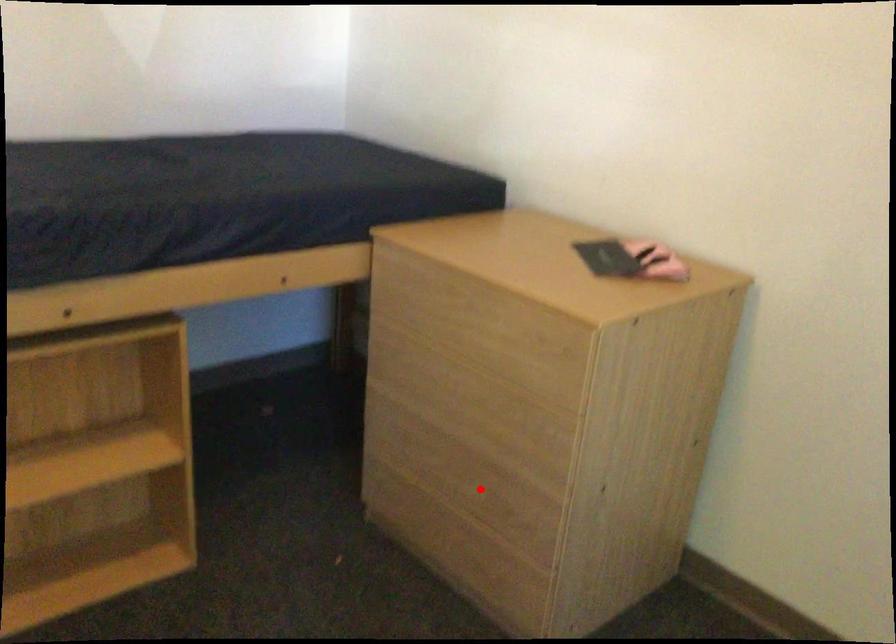
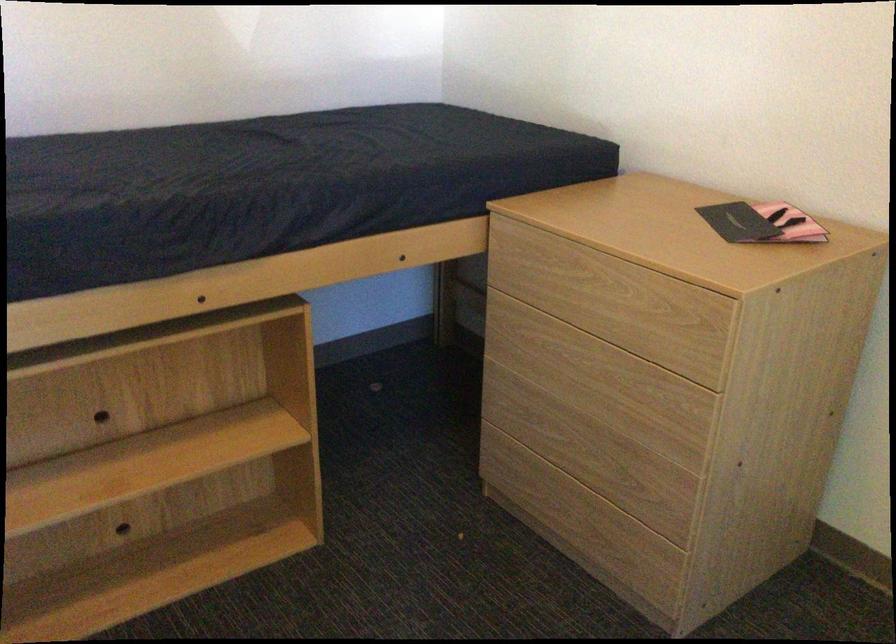
The point at the highlighted location is marked in the first image. Where is the corresponding point in the second image?

(607, 464)